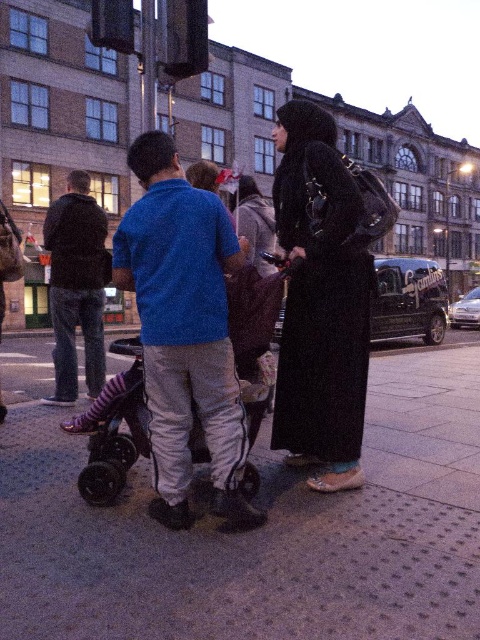
How distant is gray concrete pavement at center from black rubber baby carriage at center?

gray concrete pavement at center is 2.13 meters from black rubber baby carriage at center.

Is gray concrete pavement at center taller than black rubber baby carriage at center?

No.

Between point (110, 582) and point (135, 440), which one is positioned in front?

Point (110, 582) is in front.

This screenshot has height=640, width=480. I want to click on gray concrete pavement at center, so click(x=261, y=532).

Is black matte coat at center in front of black rubber baby carriage at center?

That is False.

Is black matte coat at center further to camera compared to black rubber baby carriage at center?

Yes, it is.

Does point (312, 269) come behind point (230, 291)?

Yes, point (312, 269) is farther from viewer.

What are the coordinates of `black matte coat at center` in the screenshot? It's located at (320, 305).

Does point (393, 518) lie behind point (360, 440)?

No, (393, 518) is in front of (360, 440).

Which is more to the right, gray concrete pavement at center or black matte coat at center?

Positioned to the right is gray concrete pavement at center.

The height and width of the screenshot is (640, 480). Find the location of `gray concrete pavement at center`. gray concrete pavement at center is located at coordinates (261, 532).

Identify the location of gray concrete pavement at center. This screenshot has width=480, height=640. (261, 532).